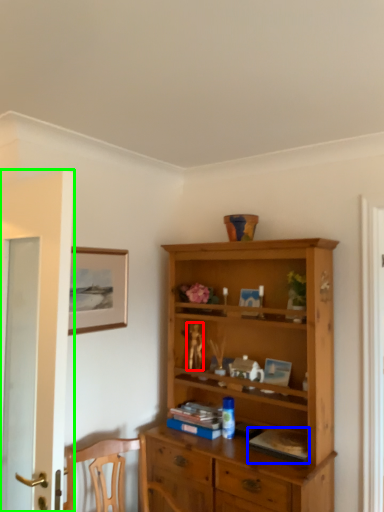
Question: Which object is the farthest from toy (highlighted by a red box)? Choose among these: book (highlighted by a blue box) or door (highlighted by a green box).

Choices:
 (A) book
 (B) door

Answer: (B)